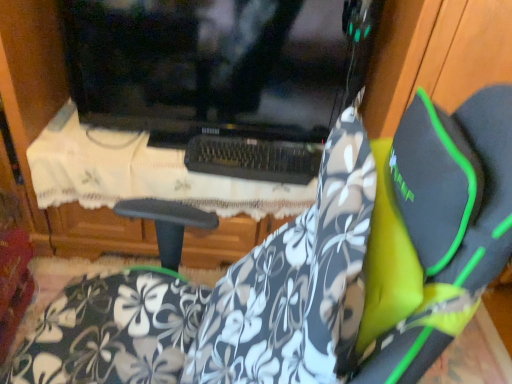
Question: Would you say white lace tablecloth at center is to the left or to the right of floral-patterned fabric at center in the picture?

Choices:
 (A) left
 (B) right

Answer: (A)

Question: From the image's perspective, relative to floral-patterned fabric at center, is white lace tablecloth at center above or below?

Choices:
 (A) below
 (B) above

Answer: (B)

Question: Considering the positions of white lace tablecloth at center and floral-patterned fabric at center in the image, is white lace tablecloth at center wider or thinner than floral-patterned fabric at center?

Choices:
 (A) wide
 (B) thin

Answer: (A)

Question: Considering their positions, is floral-patterned fabric at center located in front of or behind white lace tablecloth at center?

Choices:
 (A) front
 (B) behind

Answer: (A)

Question: Do you think floral-patterned fabric at center is within white lace tablecloth at center, or outside of it?

Choices:
 (A) outside
 (B) inside

Answer: (A)

Question: From the image's perspective, relative to white lace tablecloth at center, is floral-patterned fabric at center above or below?

Choices:
 (A) below
 (B) above

Answer: (A)

Question: From their relative heights in the image, would you say floral-patterned fabric at center is taller or shorter than white lace tablecloth at center?

Choices:
 (A) short
 (B) tall

Answer: (B)